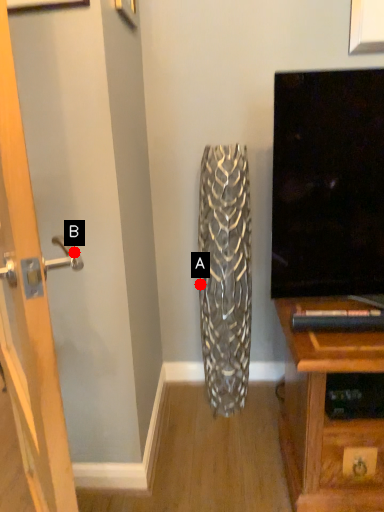
Question: Two points are circled on the image, labeled by A and B beside each circle. Which point is farther to the camera?

Choices:
 (A) A is further
 (B) B is further

Answer: (A)